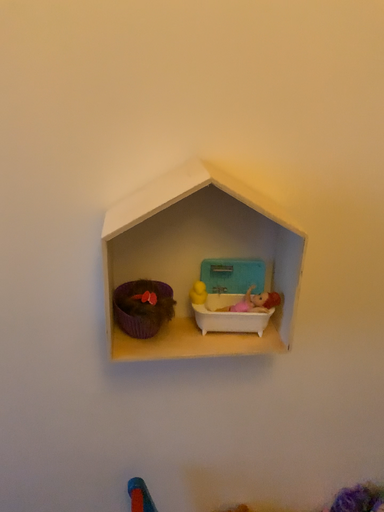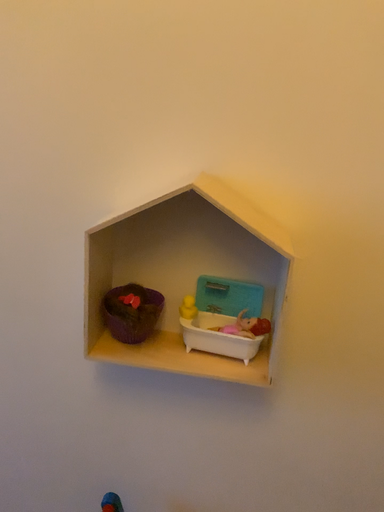
Question: Which way did the camera rotate in the video?

Choices:
 (A) rotated left
 (B) rotated right

Answer: (A)